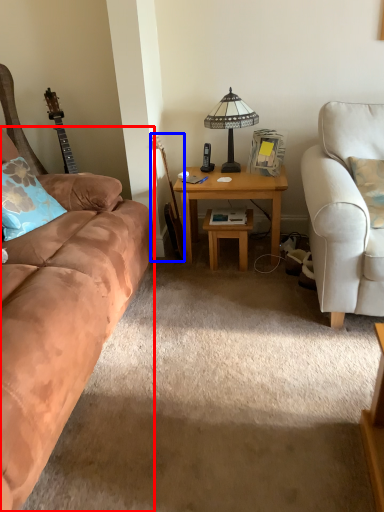
Question: Which object appears closest to the camera in this image, studio couch (highlighted by a red box) or guitar (highlighted by a blue box)?

Choices:
 (A) studio couch
 (B) guitar

Answer: (A)